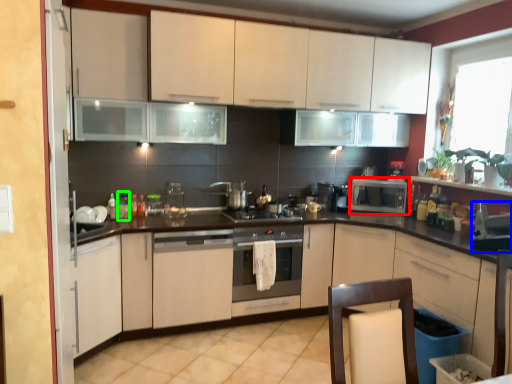
Question: Estimate the real-world distances between objects in this image. Which object is farther from microwave oven (highlighted by a red box), appliance (highlighted by a blue box) or bottle (highlighted by a green box)?

Choices:
 (A) appliance
 (B) bottle

Answer: (B)